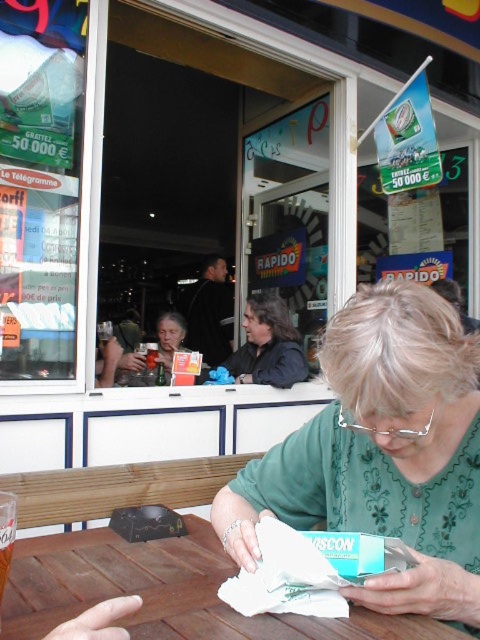
You are a customer at the outdoor cafe and want to grab your dark brown leather jacket at center and your matte plastic cup at upper left. Which item should you reach for first to avoid disturbing the other items on the table?

You should reach for the dark brown leather jacket at center first because it is closer to you than the matte plastic cup at upper left.